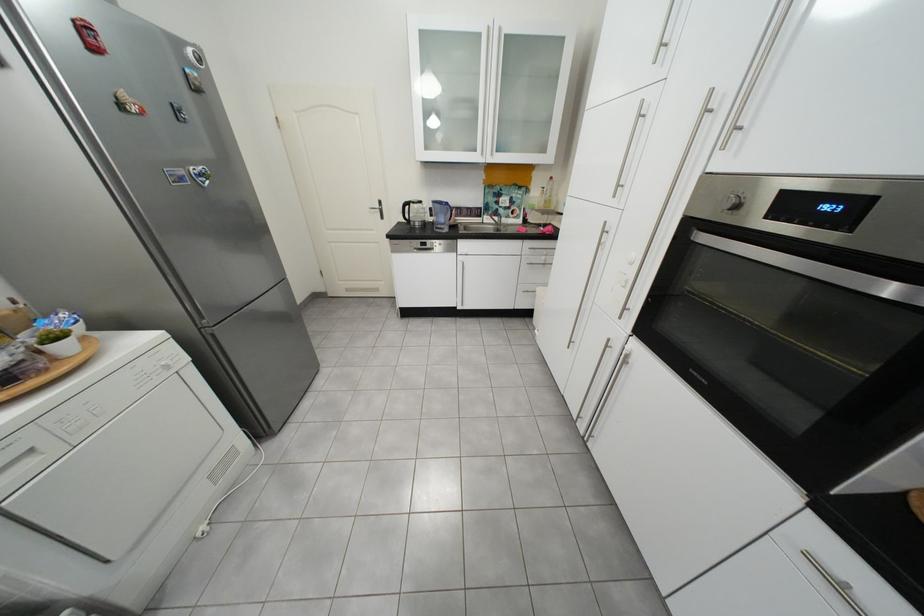
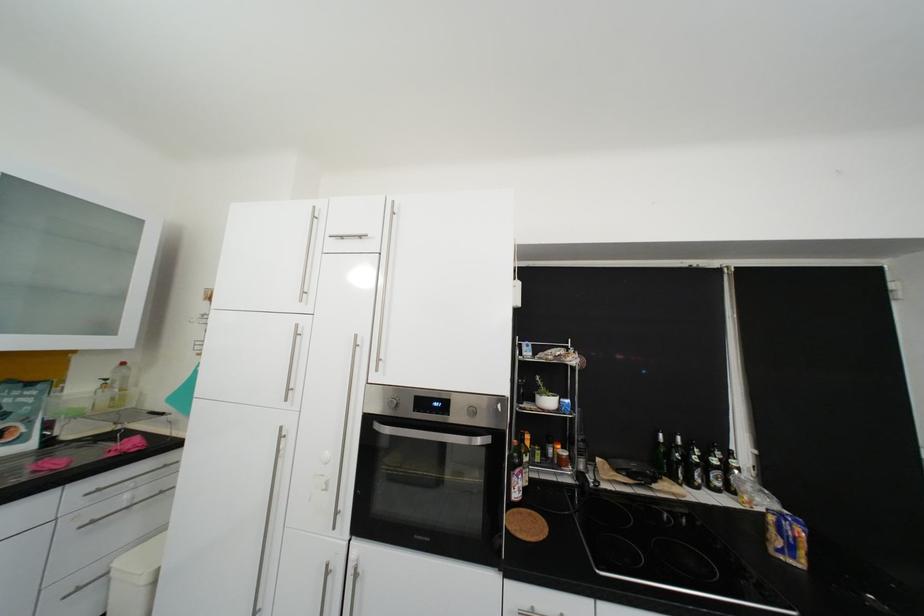
Find the pixel in the second image that matches (837,208) in the first image.

(447, 406)